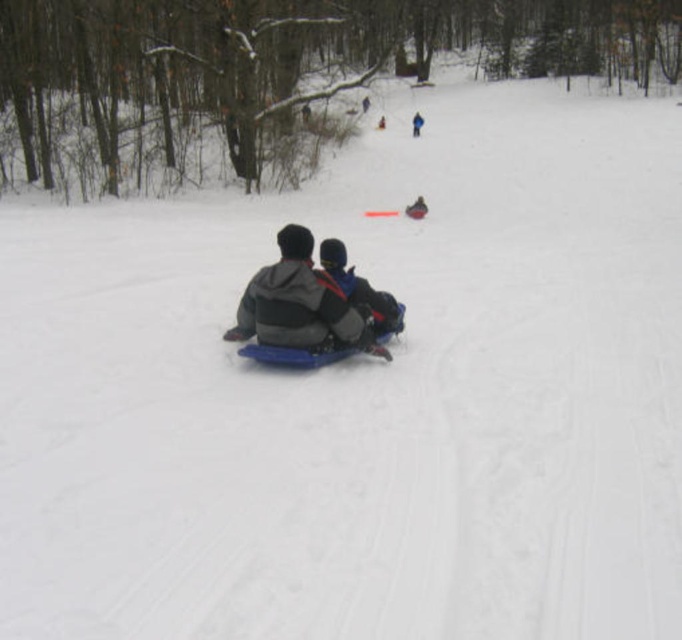
You are standing at the top of the slope and see the blue plastic sled at center and the dark gray fleece jacket at center. If you want to reach the sled first, which direction should you move towards?

The blue plastic sled at center is located below the dark gray fleece jacket at center, so you should move downward towards the blue plastic sled at center to reach it first.

You are standing at the top of the slope and see the blue plastic sled at center. If you want to reach the sled quickly, how many steps would you need to take if each step covers 0.7 meters?

The blue plastic sled at center is 7.03 meters away from viewer. Since each step covers 0.7 meters, dividing 7.03 by 0.7 gives approximately 10.04 steps. Therefore, you would need to take around 10 steps to reach the blue plastic sled at center.